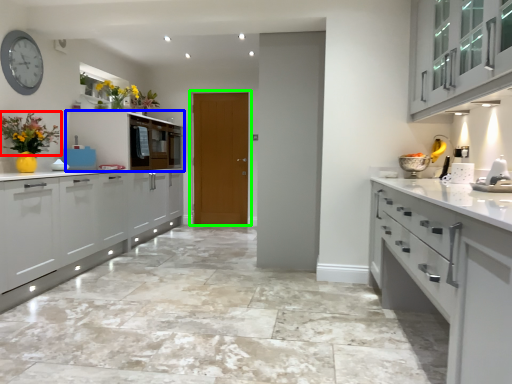
Question: Which object is positioned farthest from floral arrangement (highlighted by a red box)? Select from cabinetry (highlighted by a blue box) and door (highlighted by a green box).

Choices:
 (A) cabinetry
 (B) door

Answer: (B)